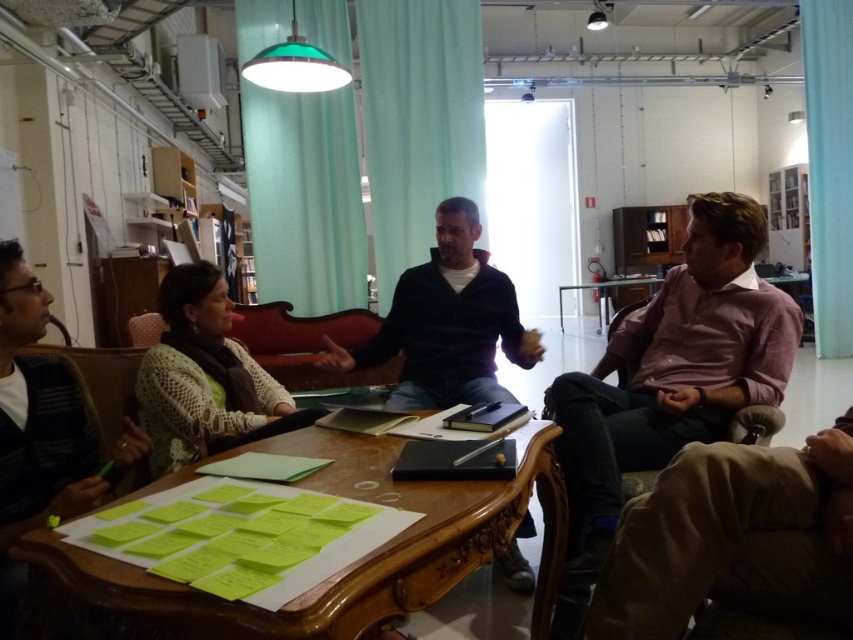
Is wooden table at center to the right of pink fabric shirt at right from the viewer's perspective?

In fact, wooden table at center is to the left of pink fabric shirt at right.

This screenshot has height=640, width=853. I want to click on wooden table at center, so click(320, 584).

At what (x,y) coordinates should I click in order to perform the action: click on wooden table at center. Please return your answer as a coordinate pair (x, y). Looking at the image, I should click on (320, 584).

Describe the element at coordinates (320, 584) in the screenshot. I see `wooden table at center` at that location.

Is wooden table at center shorter than dark blue sweater at center?

Indeed, wooden table at center has a lesser height compared to dark blue sweater at center.

Does point (437, 566) come closer to viewer compared to point (430, 336)?

That is True.

Locate an element on the screen. This screenshot has height=640, width=853. wooden table at center is located at coordinates (320, 584).

Does teal fabric curtain at center come in front of teal fabric curtain at upper right?

That is True.

Is point (434, 84) farther from viewer compared to point (833, 244)?

That is False.

In order to click on teal fabric curtain at center in this screenshot , I will do `click(418, 122)`.